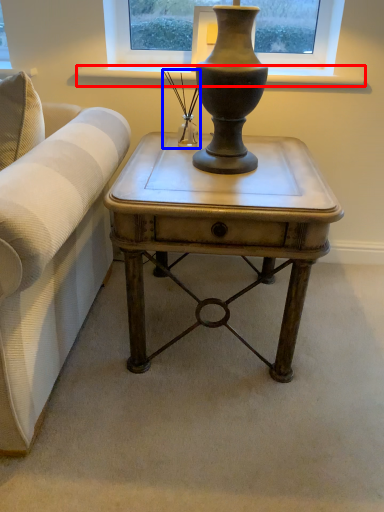
Question: Which object appears farthest to the camera in this image, window sill (highlighted by a red box) or candle holder (highlighted by a blue box)?

Choices:
 (A) window sill
 (B) candle holder

Answer: (A)